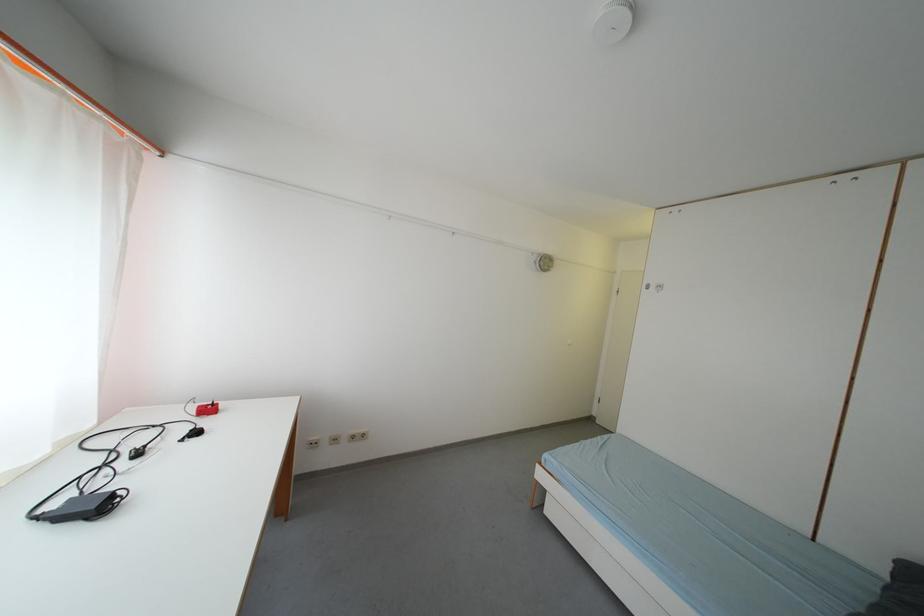
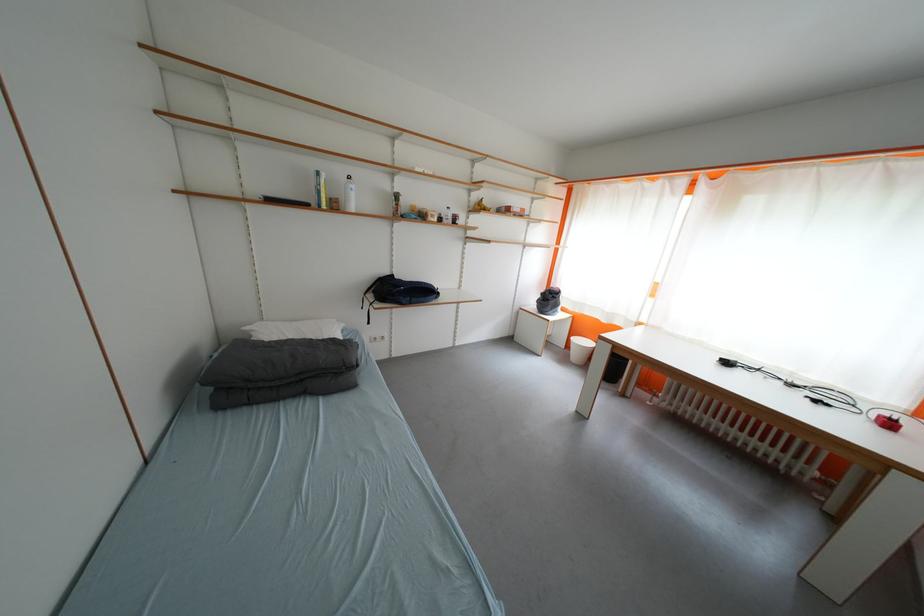
Find the pixel in the second image that matches pixel 217 413 in the first image.

(897, 428)